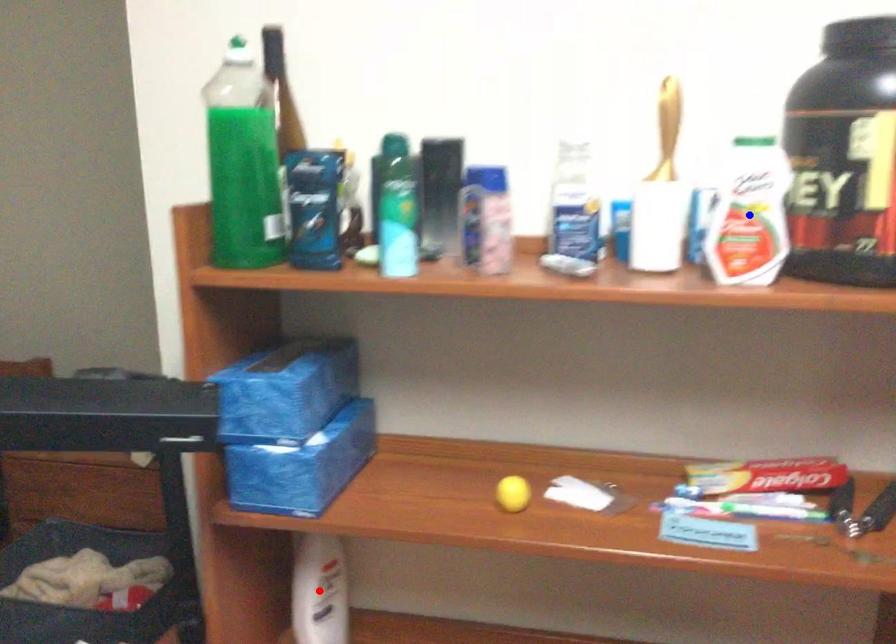
Question: In the image, two points are highlighted. Which point is nearer to the camera? Reply with the corresponding letter.

Choices:
 (A) blue point
 (B) red point

Answer: (A)